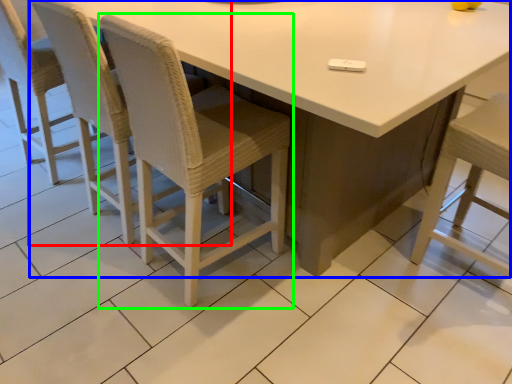
Question: Which object is positioned closest to chair (highlighted by a red box)? Select from table (highlighted by a blue box) and chair (highlighted by a green box).

Choices:
 (A) table
 (B) chair

Answer: (B)